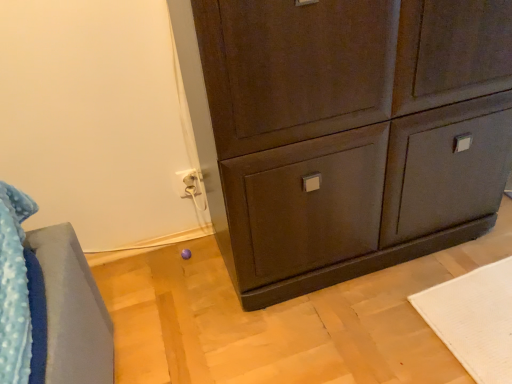
The image size is (512, 384). What do you see at coordinates (354, 132) in the screenshot?
I see `dark wood cupboard at center` at bounding box center [354, 132].

What is the approximate width of dark wood cupboard at center?

dark wood cupboard at center is 17.90 inches wide.

Identify the location of dark wood cupboard at center. (354, 132).

The width and height of the screenshot is (512, 384). I want to click on dark wood cupboard at center, so click(x=354, y=132).